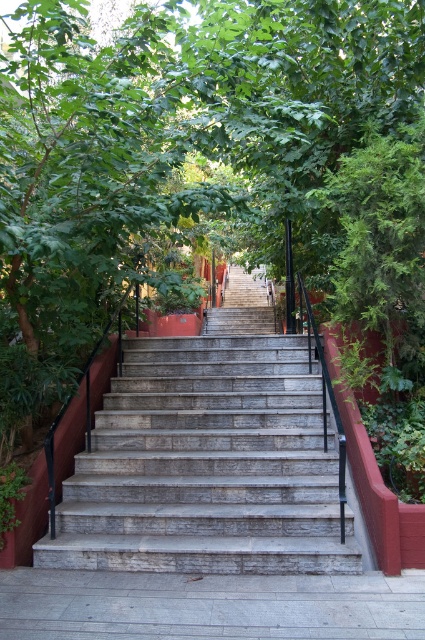
Is point (90, 253) positioned in front of point (308, 512)?

No, (90, 253) is further to viewer.

Measure the distance from green leafy tree at center to gray stone stairs at center.

green leafy tree at center is 8.57 feet away from gray stone stairs at center.

Between point (155, 40) and point (178, 532), which one is positioned behind?

The point (155, 40) is more distant.

Find the location of `green leafy tree at center`. green leafy tree at center is located at coordinates (173, 154).